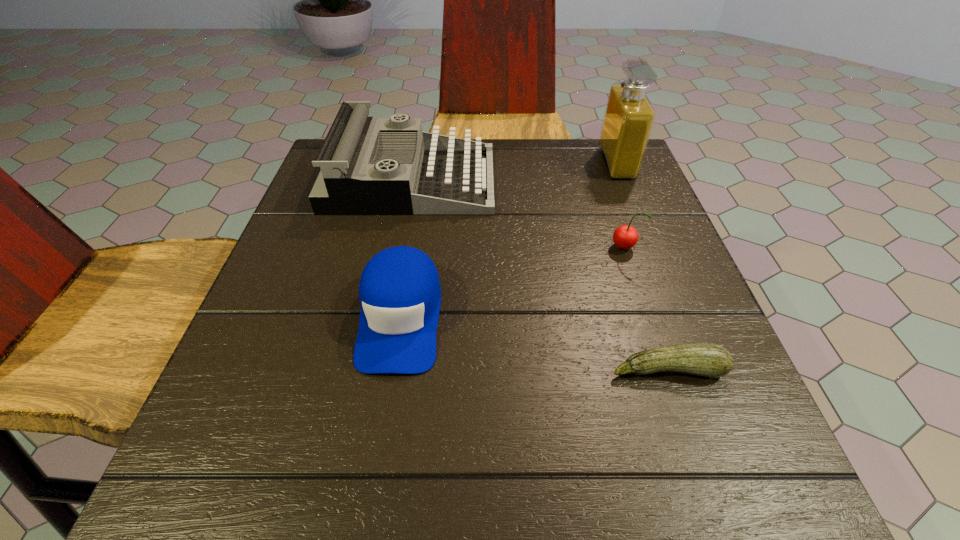
You are a GUI agent. You are given a task and a screenshot of the screen. Output one action in this format:
    pyautogui.click(x=<x>, y=<y>)
    Task: Click on the vacant region at the far edge
    The image size is (960, 540).
    Given the screenshot: What is the action you would take?
    pyautogui.click(x=522, y=177)

Where is `vacant space at the near edge of the desktop`? This screenshot has height=540, width=960. vacant space at the near edge of the desktop is located at coordinates (480, 491).

In the image, there is a desktop. Find the location of `free space at the left edge`. free space at the left edge is located at coordinates (271, 282).

Identify the location of free space at the right edge of the desktop. This screenshot has height=540, width=960. (624, 214).

The height and width of the screenshot is (540, 960). What are the coordinates of `vacant region at the far right corner` in the screenshot? It's located at (587, 187).

Identify the location of vacant space at the near right corner. (686, 494).

Identify the location of free point between the zucchini and the baseball cap. click(534, 343).

Identify the location of vacant area that lies between the second tallest object and the third farthest object. (517, 214).

I want to click on free area in between the tallest object and the baseball cap, so click(509, 240).

Identify the location of unoccupied position between the third nearest object and the fourth shortest object. (517, 214).